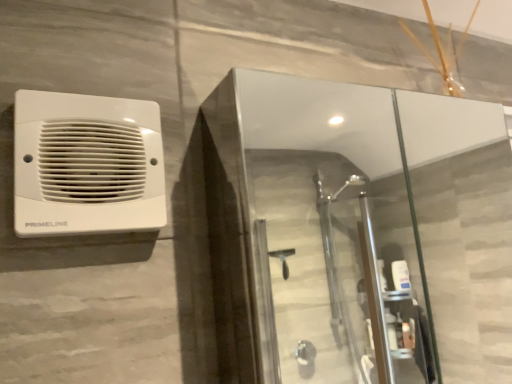
Question: In the image, is transparent glass shower door at upper center positioned in front of or behind white plastic speaker at upper left?

Choices:
 (A) front
 (B) behind

Answer: (A)

Question: Is transparent glass shower door at upper center taller or shorter than white plastic speaker at upper left?

Choices:
 (A) tall
 (B) short

Answer: (A)

Question: Is point (330, 137) closer or farther from the camera than point (101, 117)?

Choices:
 (A) closer
 (B) farther

Answer: (B)

Question: Is point (59, 165) closer or farther from the camera than point (424, 314)?

Choices:
 (A) closer
 (B) farther

Answer: (A)

Question: From the image's perspective, is white plastic speaker at upper left positioned above or below transparent glass shower door at upper center?

Choices:
 (A) below
 (B) above

Answer: (B)

Question: Would you say white plastic speaker at upper left is to the left or to the right of transparent glass shower door at upper center in the picture?

Choices:
 (A) right
 (B) left

Answer: (B)

Question: In the image, is white plastic speaker at upper left positioned in front of or behind transparent glass shower door at upper center?

Choices:
 (A) front
 (B) behind

Answer: (B)